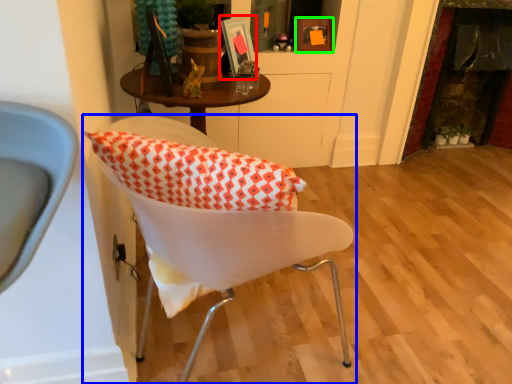
Question: Considering the real-world distances, which object is closest to picture frame (highlighted by a red box)? chair (highlighted by a blue box) or picture frame (highlighted by a green box).

Choices:
 (A) chair
 (B) picture frame

Answer: (B)